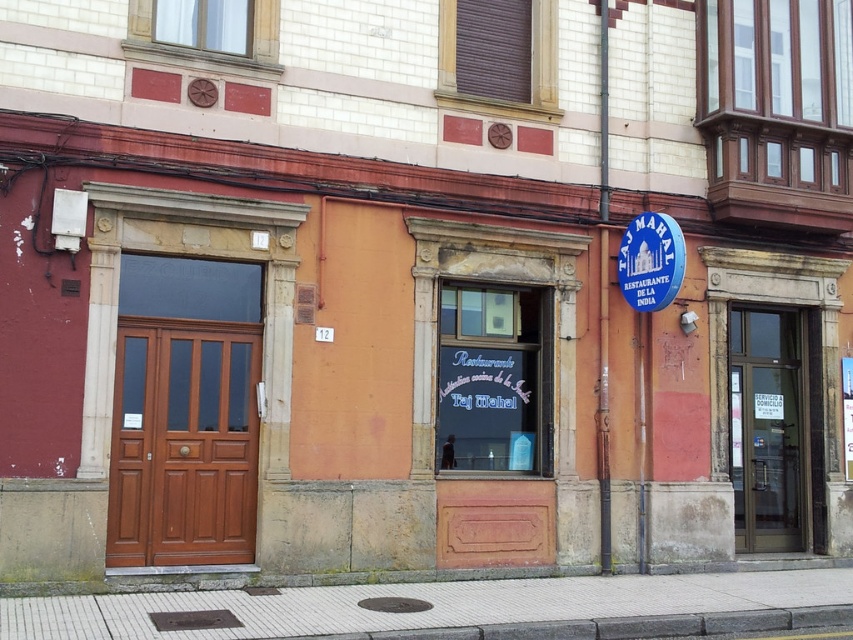
You are standing in front of the building and want to touch both points mentioned. Which point should you reach for first, the point at coordinate [796,326] or the point at [676,234]?

You should reach for point [796,326] first because it is closer to you than point [676,234], which is further away.

You are standing in front of a building with a warm orange facade. You see a point marked at coordinates (183, 442). According to the scene description, which object does this point belong to?

The point at coordinates (183, 442) is on the brown wooden door at center.